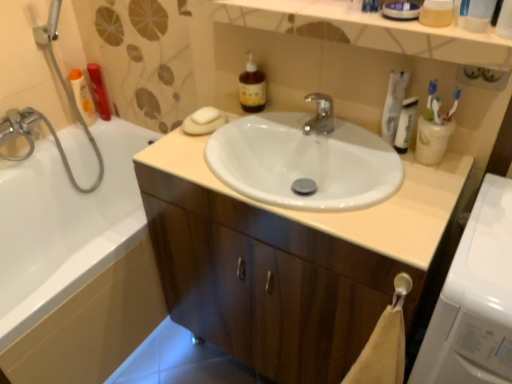
Question: In the image, is white plastic tube at upper right, placed as the first mouthwash when sorted from front to back, on the left side or the right side of translucent plastic bottle at upper left, which appears as the 2th mouthwash when viewed from the front?

Choices:
 (A) left
 (B) right

Answer: (B)

Question: From the image's perspective, is white plastic tube at upper right, which appears as the 1th mouthwash when viewed from the right, above or below translucent plastic bottle at upper left, the third mouthwash viewed from the right?

Choices:
 (A) above
 (B) below

Answer: (B)

Question: Estimate the real-world distances between objects in this image. Which object is farther from the white plastic cup at upper right?

Choices:
 (A) white plastic toothbrush at upper right, acting as the first toothbrush starting from the right
 (B) white glossy sink at center
 (C) translucent amber liquid at upper center
 (D) white plastic tube at upper right, which is counted as the third mouthwash, starting from the left
 (E) white glossy tube at upper right

Answer: (C)

Question: Considering the real-world distances, which object is closest to the white glossy bathtub at left?

Choices:
 (A) white matte soap at upper center
 (B) white glossy washing machine at right
 (C) white glossy sink at center
 (D) white glossy tube at upper right
 (E) white plastic tube at upper right, which is counted as the third mouthwash, starting from the left

Answer: (A)